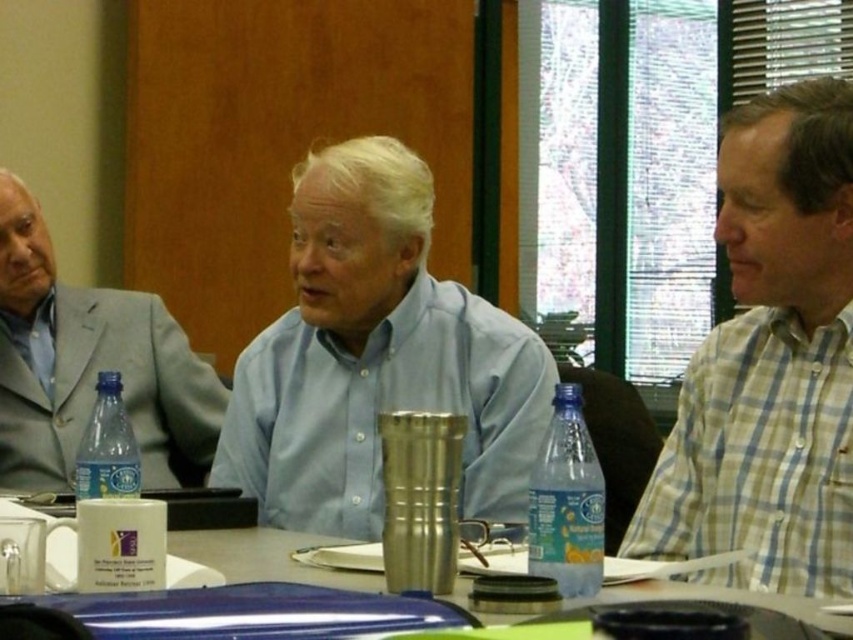
Does matte blue shirt at center lie in front of gray suit jacket at left?

Yes, it is.

Does matte blue shirt at center lie behind gray suit jacket at left?

That is False.

You are a GUI agent. You are given a task and a screenshot of the screen. Output one action in this format:
    pyautogui.click(x=<x>, y=<y>)
    Task: Click on the matte blue shirt at center
    
    Given the screenshot: What is the action you would take?
    pyautogui.click(x=376, y=356)

At what (x,y) coordinates should I click in order to perform the action: click on light blue plaid shirt at center. Please return your answer as a coordinate pair (x, y). The height and width of the screenshot is (640, 853). Looking at the image, I should click on (770, 362).

Which is more to the left, light blue plaid shirt at center or blue plastic bottle at lower left?

Positioned to the left is blue plastic bottle at lower left.

Locate an element on the screen. The width and height of the screenshot is (853, 640). light blue plaid shirt at center is located at coordinates (770, 362).

Does light blue plaid shirt at center appear on the right side of metallic blue laptop at center?

Yes, light blue plaid shirt at center is to the right of metallic blue laptop at center.

Does light blue plaid shirt at center have a lesser width compared to metallic blue laptop at center?

Indeed, light blue plaid shirt at center has a lesser width compared to metallic blue laptop at center.

The width and height of the screenshot is (853, 640). Describe the element at coordinates (770, 362) in the screenshot. I see `light blue plaid shirt at center` at that location.

You are a GUI agent. You are given a task and a screenshot of the screen. Output one action in this format:
    pyautogui.click(x=<x>, y=<y>)
    Task: Click on the light blue plaid shirt at center
    The height and width of the screenshot is (640, 853).
    Given the screenshot: What is the action you would take?
    pyautogui.click(x=770, y=362)